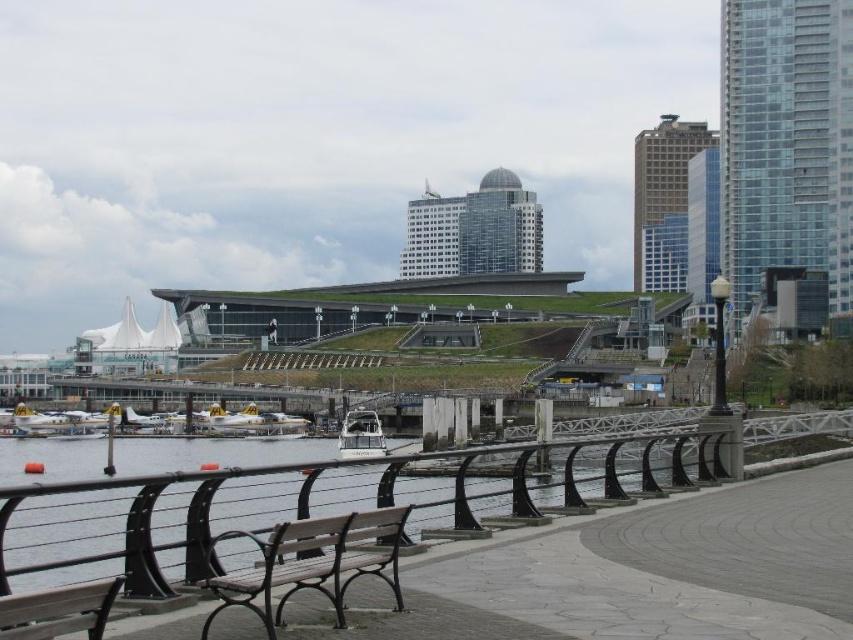
You are a photographer standing on the walkway and want to capture both the black metal railing at lower left and the white glossy boat at center in the same frame. Which object should you position closer to the left side of your camera viewfinder to include both in the shot?

The black metal railing at lower left is positioned on the right side of the white glossy boat at center, so to include both in the frame, you should position the white glossy boat at center closer to the left side of your camera viewfinder.

You are standing on the walkway and want to take a photo of the white glossy boat at center without the black metal railing at lower left blocking the view. Is this possible?

The black metal railing at lower left is in front of the white glossy boat at center, so it will block the view. Move to a position where the railing is not between you and the boat to take the photo.

You are a visitor standing on the walkway and want to sit down. You see the wooden bench at lower left and the white glossy boat at center. Which object is closer to your current position?

Answer: The wooden bench at lower left is closer to your current position because it is positioned on the right side of the white glossy boat at center, which is further away in the water.